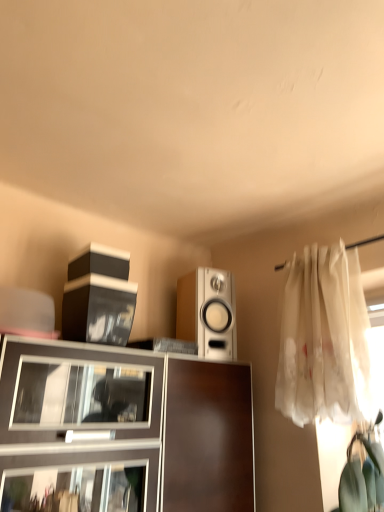
What do you see at coordinates (122, 430) in the screenshot? I see `matte brown cabinet at center` at bounding box center [122, 430].

This screenshot has height=512, width=384. Describe the element at coordinates (208, 312) in the screenshot. I see `white glossy speaker at center` at that location.

The width and height of the screenshot is (384, 512). I want to click on white sheer curtain at right, so (325, 339).

I want to click on matte brown cabinet at center, so click(x=122, y=430).

Between white sheer curtain at right and matte brown cabinet at center, which one has larger size?

matte brown cabinet at center.

From their relative heights in the image, would you say white sheer curtain at right is taller or shorter than matte brown cabinet at center?

In the image, white sheer curtain at right appears to be taller than matte brown cabinet at center.

Is white sheer curtain at right inside or outside of matte brown cabinet at center?

The correct answer is: outside.

Measure the distance from white sheer curtain at right to matte brown cabinet at center.

A distance of 20.93 inches exists between white sheer curtain at right and matte brown cabinet at center.

Is matte brown cabinet at center taller than white sheer curtain at right?

In fact, matte brown cabinet at center may be shorter than white sheer curtain at right.

Is matte brown cabinet at center positioned beyond the bounds of white sheer curtain at right?

That's correct, matte brown cabinet at center is outside of white sheer curtain at right.

How many degrees apart are the facing directions of matte brown cabinet at center and white sheer curtain at right?

The angle between the facing direction of matte brown cabinet at center and the facing direction of white sheer curtain at right is 90.1 degrees.

Can you confirm if matte brown cabinet at center is taller than white glossy speaker at center?

Yes, matte brown cabinet at center is taller than white glossy speaker at center.

Are matte brown cabinet at center and white glossy speaker at center located far from each other?

No.

From a real-world perspective, is matte brown cabinet at center physically below white glossy speaker at center?

Correct, in the physical world, matte brown cabinet at center is lower than white glossy speaker at center.

Consider the image. Considering the relative sizes of white sheer curtain at right and white glossy speaker at center in the image provided, is white sheer curtain at right thinner than white glossy speaker at center?

Yes.

Considering the positions of objects white sheer curtain at right and white glossy speaker at center in the image provided, who is in front, white sheer curtain at right or white glossy speaker at center?

white sheer curtain at right is closer to the camera.

Which is correct: white sheer curtain at right is inside white glossy speaker at center, or outside of it?

The correct answer is: outside.

Is white sheer curtain at right with white glossy speaker at center?

No, white sheer curtain at right is not making contact with white glossy speaker at center.

Considering the positions of objects white glossy speaker at center and white sheer curtain at right in the image provided, who is in front, white glossy speaker at center or white sheer curtain at right?

Positioned in front is white sheer curtain at right.

Does point (200, 349) appear closer or farther from the camera than point (312, 379)?

Clearly, point (200, 349) is more distant from the camera than point (312, 379).

Considering the relative positions of white glossy speaker at center and white sheer curtain at right in the image provided, is white glossy speaker at center to the left or to the right of white sheer curtain at right?

Clearly, white glossy speaker at center is on the left of white sheer curtain at right in the image.

Is white glossy speaker at center thinner than white sheer curtain at right?

Incorrect, the width of white glossy speaker at center is not less than that of white sheer curtain at right.

Does white glossy speaker at center lie in front of matte brown cabinet at center?

No, it is behind matte brown cabinet at center.

Which object is positioned more to the right, white glossy speaker at center or matte brown cabinet at center?

white glossy speaker at center is more to the right.

Is white glossy speaker at center inside the boundaries of matte brown cabinet at center, or outside?

The correct answer is: outside.

You are a GUI agent. You are given a task and a screenshot of the screen. Output one action in this format:
    pyautogui.click(x=<x>, y=<y>)
    Task: Click on the curtain above the matte brown cabinet at center (from a real-world perspective)
    The image size is (384, 512).
    Given the screenshot: What is the action you would take?
    325,339

Identify the location of cabinetry below the white sheer curtain at right (from the image's perspective). pos(122,430).

Based on their spatial positions, is white sheer curtain at right or white glossy speaker at center further from matte brown cabinet at center?

Based on the image, white sheer curtain at right appears to be further to matte brown cabinet at center.

From the image, which object appears to be farther from white sheer curtain at right, matte brown cabinet at center or white glossy speaker at center?

matte brown cabinet at center lies further to white sheer curtain at right than the other object.

Looking at the image, which one is located further to white glossy speaker at center, white sheer curtain at right or matte brown cabinet at center?

Among the two, white sheer curtain at right is located further to white glossy speaker at center.

When comparing their distances from white glossy speaker at center, does matte brown cabinet at center or white sheer curtain at right seem further?

white sheer curtain at right is further to white glossy speaker at center.

Considering their positions, is white glossy speaker at center positioned closer to white sheer curtain at right than matte brown cabinet at center?

white glossy speaker at center.

From the image, which object appears to be farther from matte brown cabinet at center, white glossy speaker at center or white sheer curtain at right?

Among the two, white sheer curtain at right is located further to matte brown cabinet at center.

The height and width of the screenshot is (512, 384). Identify the location of curtain between matte brown cabinet at center and white glossy speaker at center from front to back. (325, 339).